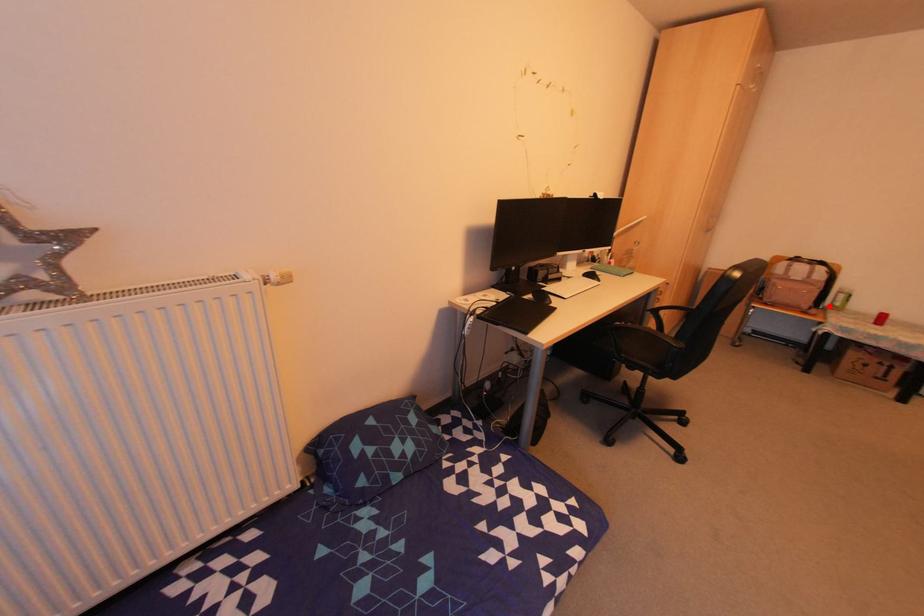
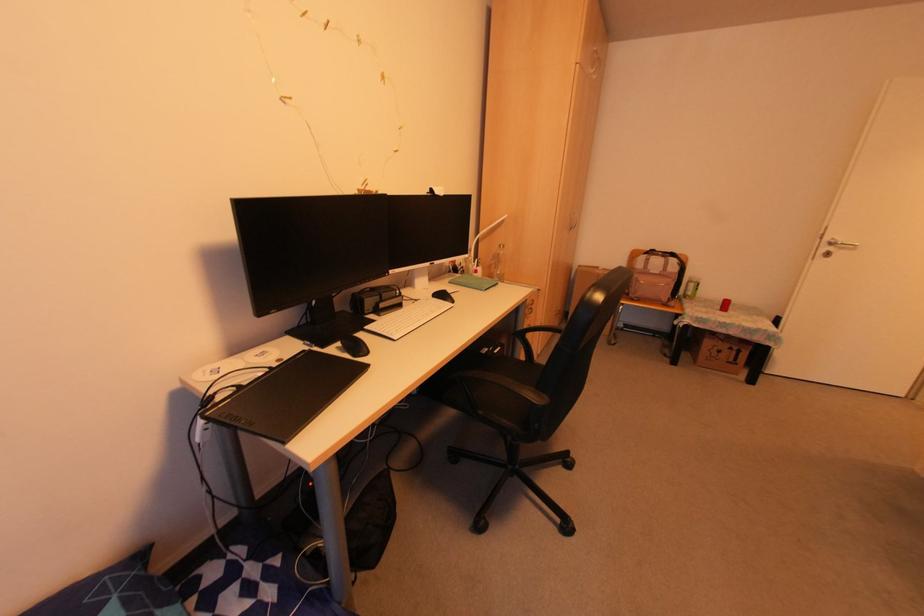
Where in the second image is the point corresponding to the highlighted location from the first image?

(683, 296)